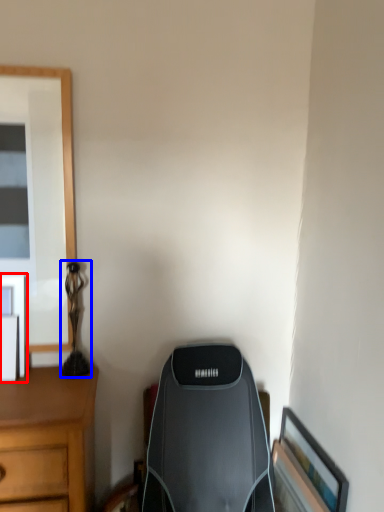
Question: Which object is closer to the camera taking this photo, picture frame (highlighted by a red box) or table lamp (highlighted by a blue box)?

Choices:
 (A) picture frame
 (B) table lamp

Answer: (A)